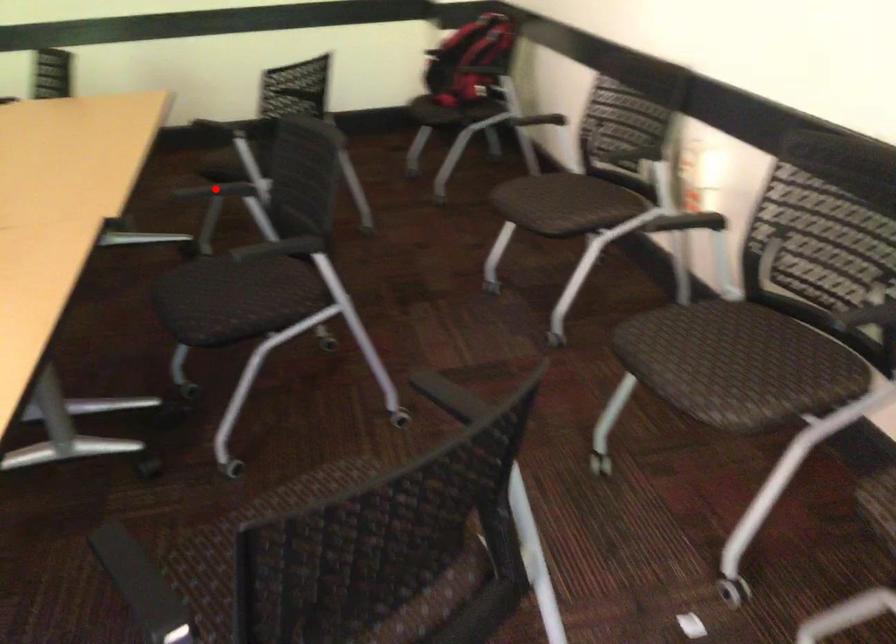
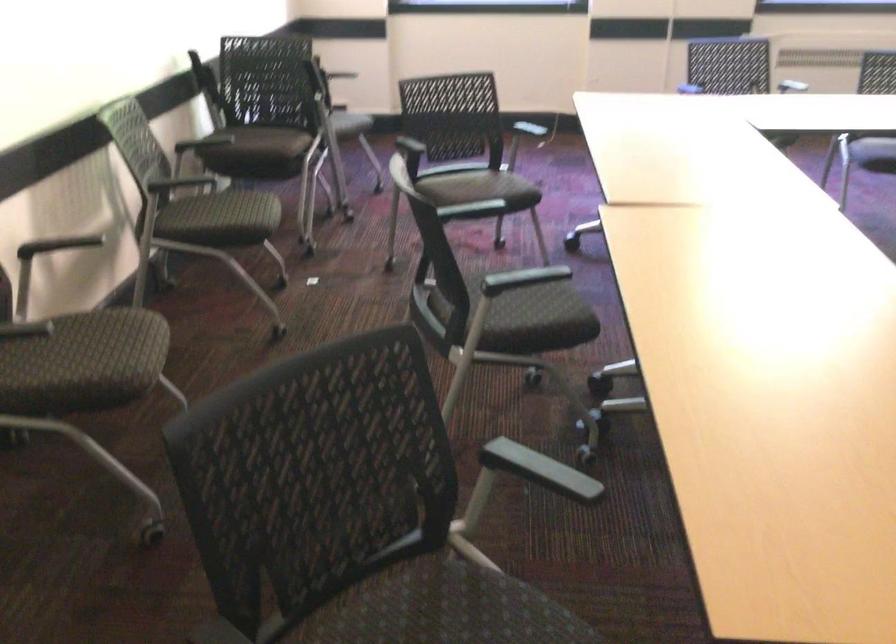
Question: I am providing you with two images of the same scene from different viewpoints. A red point is marked on the first image. Is the red point's position out of view in image 2?

Choices:
 (A) Yes
 (B) No

Answer: (A)